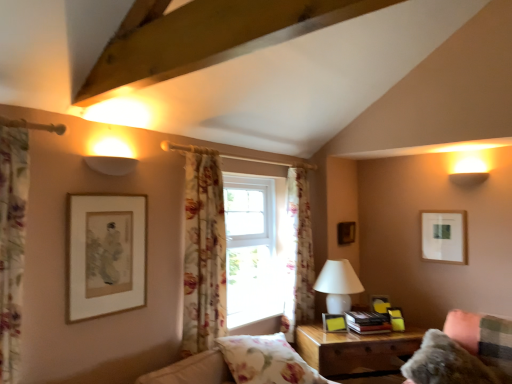
What are the coordinates of `vacant area that is in front of matte yellow picture frame at right, which is counted as the fifth picture frame, starting from the right` in the screenshot? It's located at (340, 334).